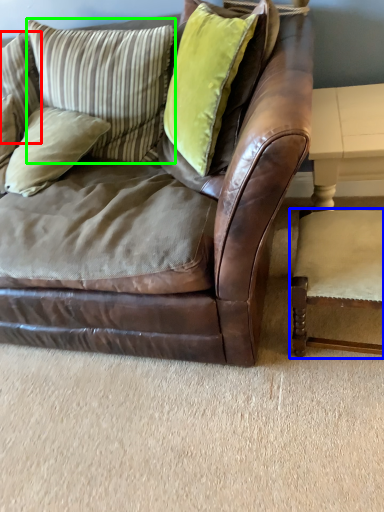
Question: Which is nearer to the pillow (highlighted by a red box)? chair (highlighted by a blue box) or pillow (highlighted by a green box).

Choices:
 (A) chair
 (B) pillow

Answer: (B)